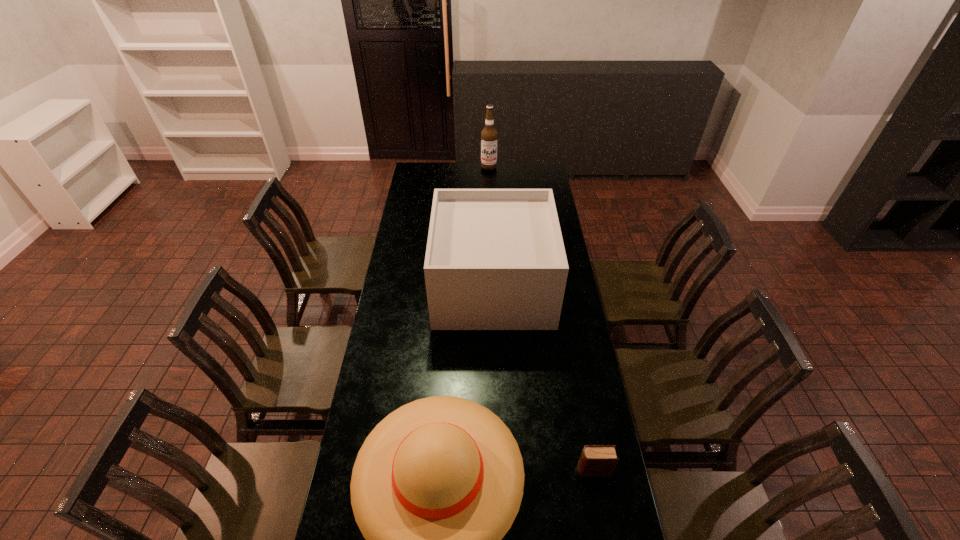
Locate an element on the screen. The height and width of the screenshot is (540, 960). object that is the second closest one to the alcohol is located at coordinates coord(436,485).